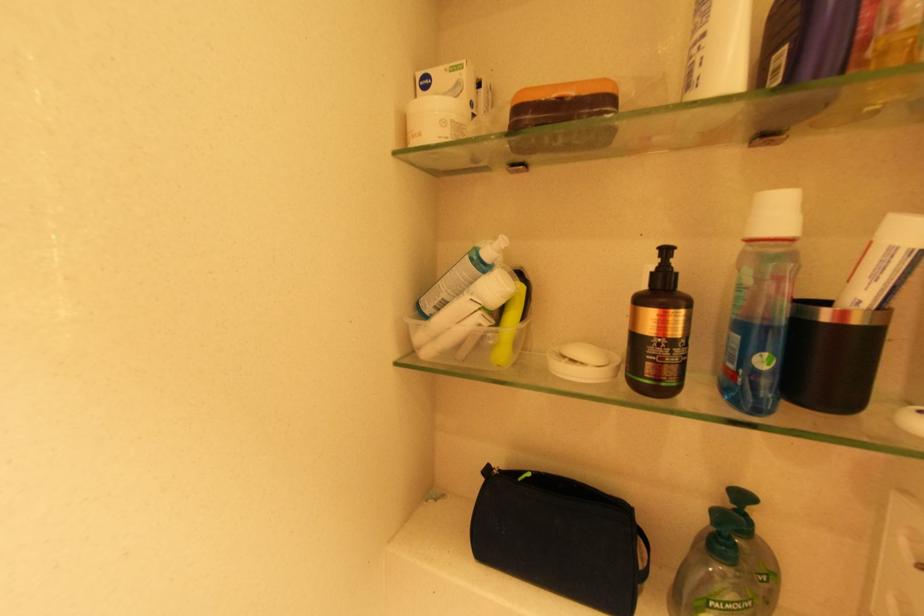
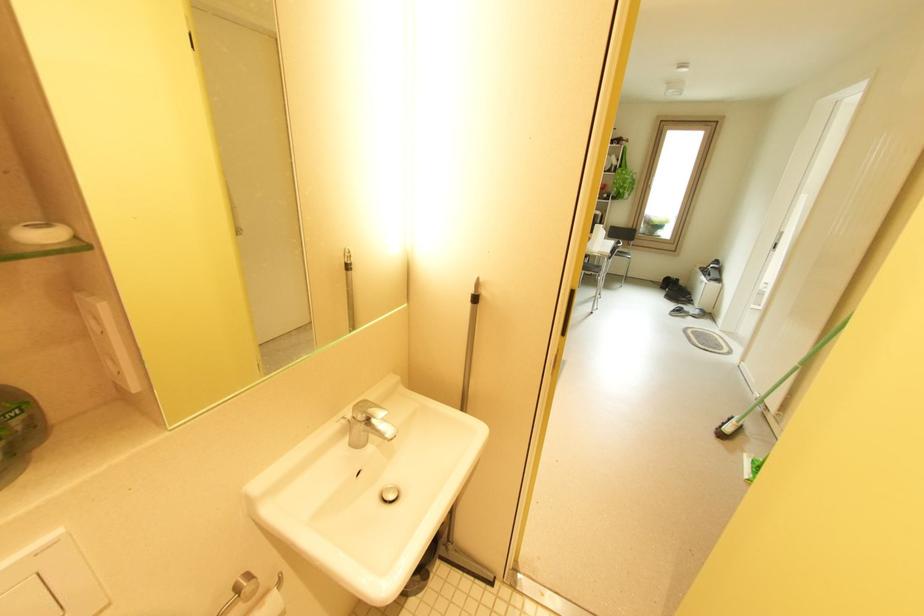
The images are taken continuously from a first-person perspective. In which direction is your viewpoint rotating?

The camera's rotation is toward right-down.